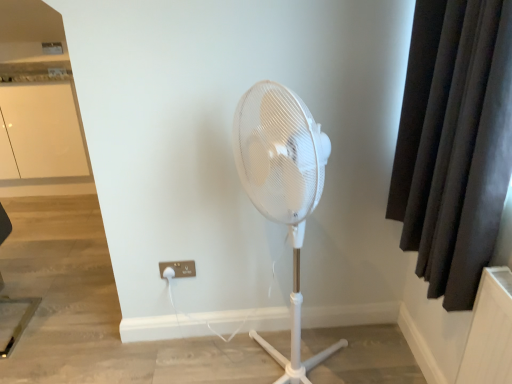
Question: Which direction should I rotate to look at white plastic electric outlet at lower center?

Choices:
 (A) left
 (B) right

Answer: (A)

Question: Is white plastic electric outlet at lower center looking in the opposite direction of white glossy cabinet at upper left?

Choices:
 (A) yes
 (B) no

Answer: (B)

Question: Considering the relative positions of white plastic electric outlet at lower center and white glossy cabinet at upper left in the image provided, is white plastic electric outlet at lower center behind white glossy cabinet at upper left?

Choices:
 (A) no
 (B) yes

Answer: (A)

Question: Considering the relative positions of white plastic electric outlet at lower center and white glossy cabinet at upper left in the image provided, is white plastic electric outlet at lower center to the right of white glossy cabinet at upper left from the viewer's perspective?

Choices:
 (A) no
 (B) yes

Answer: (B)

Question: Can we say white plastic electric outlet at lower center lies outside white glossy cabinet at upper left?

Choices:
 (A) yes
 (B) no

Answer: (A)

Question: Is white plastic electric outlet at lower center directly adjacent to white glossy cabinet at upper left?

Choices:
 (A) no
 (B) yes

Answer: (A)

Question: Considering the relative sizes of white plastic electric outlet at lower center and white glossy cabinet at upper left in the image provided, is white plastic electric outlet at lower center wider than white glossy cabinet at upper left?

Choices:
 (A) yes
 (B) no

Answer: (B)

Question: Is white glossy cabinet at upper left completely or partially outside of dark fabric curtain at right?

Choices:
 (A) no
 (B) yes

Answer: (B)

Question: From a real-world perspective, is white glossy cabinet at upper left below dark fabric curtain at right?

Choices:
 (A) no
 (B) yes

Answer: (B)

Question: From the image's perspective, would you say white glossy cabinet at upper left is shown under dark fabric curtain at right?

Choices:
 (A) no
 (B) yes

Answer: (A)

Question: Is the position of white glossy cabinet at upper left less distant than that of dark fabric curtain at right?

Choices:
 (A) no
 (B) yes

Answer: (A)

Question: Does white glossy cabinet at upper left have a lesser width compared to dark fabric curtain at right?

Choices:
 (A) no
 (B) yes

Answer: (A)

Question: Is white glossy cabinet at upper left shorter than dark fabric curtain at right?

Choices:
 (A) yes
 (B) no

Answer: (B)

Question: Would you say dark fabric curtain at right is a long distance from white plastic electric outlet at lower center?

Choices:
 (A) yes
 (B) no

Answer: (A)